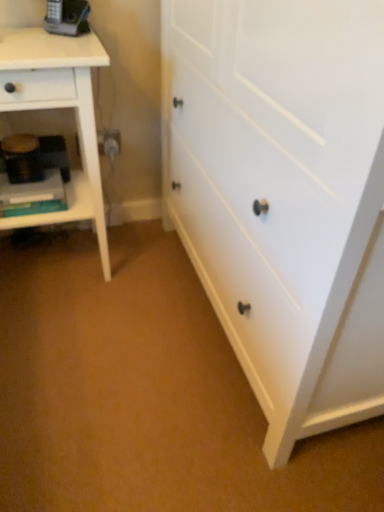
What do you see at coordinates (283, 196) in the screenshot? The width and height of the screenshot is (384, 512). I see `white matte chest of drawers at center` at bounding box center [283, 196].

The width and height of the screenshot is (384, 512). In order to click on white wood nightstand at left in this screenshot , I will do `click(59, 106)`.

From the image's perspective, is matte black phone at upper left above or below white matte chest of drawers at center?

Clearly, from the image's perspective, matte black phone at upper left is above white matte chest of drawers at center.

Looking at the image, does matte black phone at upper left seem bigger or smaller compared to white matte chest of drawers at center?

matte black phone at upper left is smaller than white matte chest of drawers at center.

Is matte black phone at upper left shorter than white matte chest of drawers at center?

Indeed, matte black phone at upper left has a lesser height compared to white matte chest of drawers at center.

Is white matte chest of drawers at center further to camera compared to white wood nightstand at left?

No, it is not.

Is white matte chest of drawers at center smaller than white wood nightstand at left?

Incorrect, white matte chest of drawers at center is not smaller in size than white wood nightstand at left.

Where is `nightstand lying above the white matte chest of drawers at center (from the image's perspective)`? Image resolution: width=384 pixels, height=512 pixels. nightstand lying above the white matte chest of drawers at center (from the image's perspective) is located at coordinates (59, 106).

Which is behind, point (166, 105) or point (8, 29)?

The point (166, 105) is behind.

Which is less distant, (x=24, y=46) or (x=371, y=26)?

Point (x=371, y=26)

Is white wood nightstand at left positioned beyond the bounds of white matte chest of drawers at center?

Yes, white wood nightstand at left is not within white matte chest of drawers at center.

Is white wood nightstand at left positioned with its back to white matte chest of drawers at center?

That's not correct — white wood nightstand at left is not looking away from white matte chest of drawers at center.

Is matte black phone at upper left surrounded by white wood nightstand at left?

No, matte black phone at upper left is not a part of white wood nightstand at left.

Which point is more forward, (x=71, y=42) or (x=63, y=30)?

Point (x=71, y=42)

Looking at their sizes, would you say white wood nightstand at left is wider or thinner than matte black phone at upper left?

In the image, white wood nightstand at left appears to be wider than matte black phone at upper left.

You are a GUI agent. You are given a task and a screenshot of the screen. Output one action in this format:
    pyautogui.click(x=<x>, y=<y>)
    Task: Click on the nightstand located underneath the matte black phone at upper left (from a real-world perspective)
    The image size is (384, 512).
    Given the screenshot: What is the action you would take?
    pyautogui.click(x=59, y=106)

Looking at this image, from a real-world perspective, is matte black phone at upper left above or below white wood nightstand at left?

In terms of real-world spatial position, matte black phone at upper left is above white wood nightstand at left.

Is matte black phone at upper left positioned with its back to white wood nightstand at left?

No, white wood nightstand at left is not at the back of matte black phone at upper left.

Is white matte chest of drawers at center shorter than matte black phone at upper left?

Incorrect, the height of white matte chest of drawers at center does not fall short of that of matte black phone at upper left.

Between white matte chest of drawers at center and matte black phone at upper left, which one has larger width?

With larger width is white matte chest of drawers at center.

Is white matte chest of drawers at center situated inside matte black phone at upper left or outside?

white matte chest of drawers at center cannot be found inside matte black phone at upper left.

Which object is further away from the camera, white matte chest of drawers at center or matte black phone at upper left?

matte black phone at upper left is further from the camera.

At what (x,y) coordinates should I click in order to perform the action: click on the chest of drawers that is in front of the matte black phone at upper left. Please return your answer as a coordinate pair (x, y). The width and height of the screenshot is (384, 512). Looking at the image, I should click on (283, 196).

In the image, there is a white wood nightstand at left. In order to click on the chest of drawers below it (from the image's perspective) in this screenshot , I will do `click(283, 196)`.

Estimate the real-world distances between objects in this image. Which object is closer to white wood nightstand at left, white matte chest of drawers at center or matte black phone at upper left?

matte black phone at upper left.

Considering their positions, is white wood nightstand at left positioned closer to white matte chest of drawers at center than matte black phone at upper left?

Based on the image, white wood nightstand at left appears to be nearer to white matte chest of drawers at center.

Estimate the real-world distances between objects in this image. Which object is further from matte black phone at upper left, white wood nightstand at left or white matte chest of drawers at center?

Based on the image, white matte chest of drawers at center appears to be further to matte black phone at upper left.

Considering their positions, is matte black phone at upper left positioned closer to white matte chest of drawers at center than white wood nightstand at left?

Among the two, white wood nightstand at left is located nearer to white matte chest of drawers at center.

Based on their spatial positions, is white matte chest of drawers at center or white wood nightstand at left closer to matte black phone at upper left?

white wood nightstand at left is closer to matte black phone at upper left.

When comparing their distances from white wood nightstand at left, does matte black phone at upper left or white matte chest of drawers at center seem closer?

matte black phone at upper left is positioned closer to the anchor white wood nightstand at left.

Identify the location of equipment located between white wood nightstand at left and white matte chest of drawers at center in the left-right direction. 70,19.